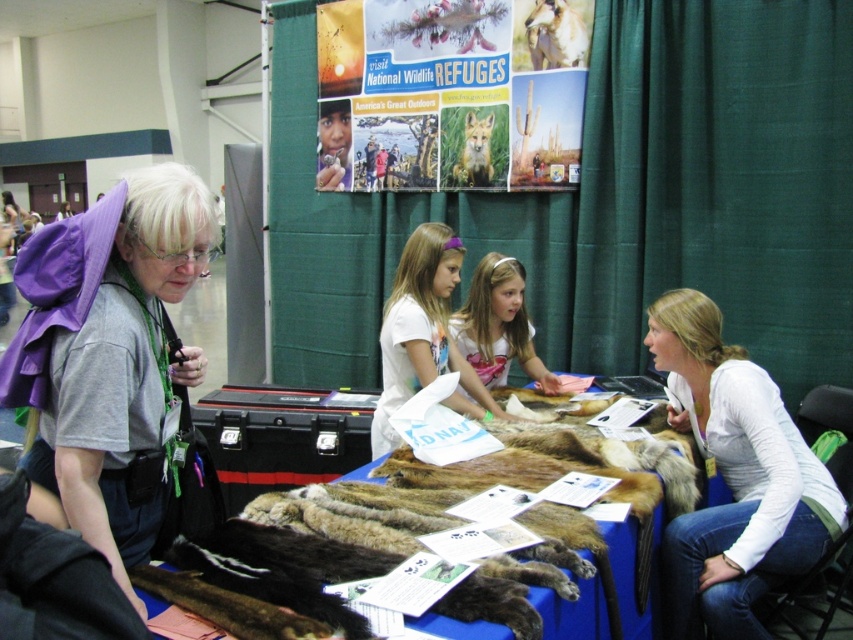
Does purple fabric at left have a larger size compared to white t-shirt at center?

Yes, purple fabric at left is bigger than white t-shirt at center.

Is purple fabric at left above white t-shirt at center?

Yes, purple fabric at left is above white t-shirt at center.

The width and height of the screenshot is (853, 640). I want to click on purple fabric at left, so tap(108, 356).

Identify the location of purple fabric at left. (108, 356).

Between purple fabric at left and fluffy fur fox at center, which one is positioned lower?

purple fabric at left is below.

Can you confirm if purple fabric at left is positioned to the right of fluffy fur fox at center?

Incorrect, purple fabric at left is not on the right side of fluffy fur fox at center.

This screenshot has height=640, width=853. What do you see at coordinates (108, 356) in the screenshot?
I see `purple fabric at left` at bounding box center [108, 356].

The width and height of the screenshot is (853, 640). I want to click on purple fabric at left, so click(108, 356).

Does brown fur at center have a lesser height compared to smooth brown fur at center?

Correct, brown fur at center is not as tall as smooth brown fur at center.

Can you confirm if brown fur at center is bigger than smooth brown fur at center?

Yes.

The height and width of the screenshot is (640, 853). What do you see at coordinates (369, 536) in the screenshot? I see `brown fur at center` at bounding box center [369, 536].

Identify the location of brown fur at center. (369, 536).